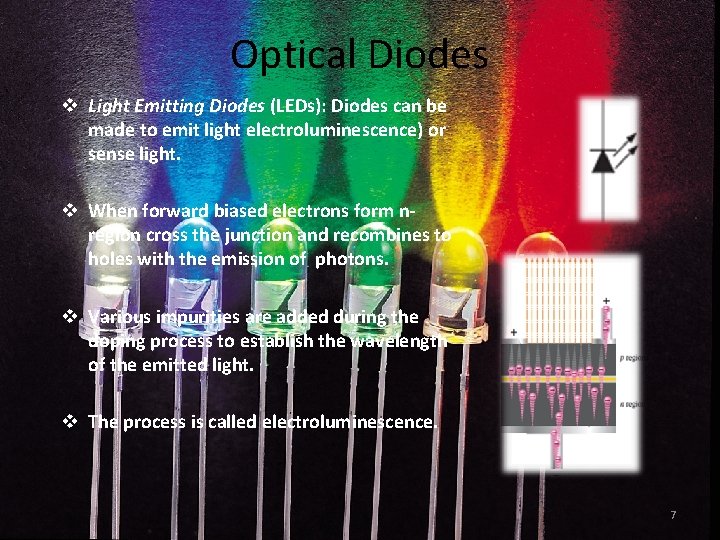
Where is `yellow light`? The width and height of the screenshot is (720, 540). yellow light is located at coordinates (469, 165).